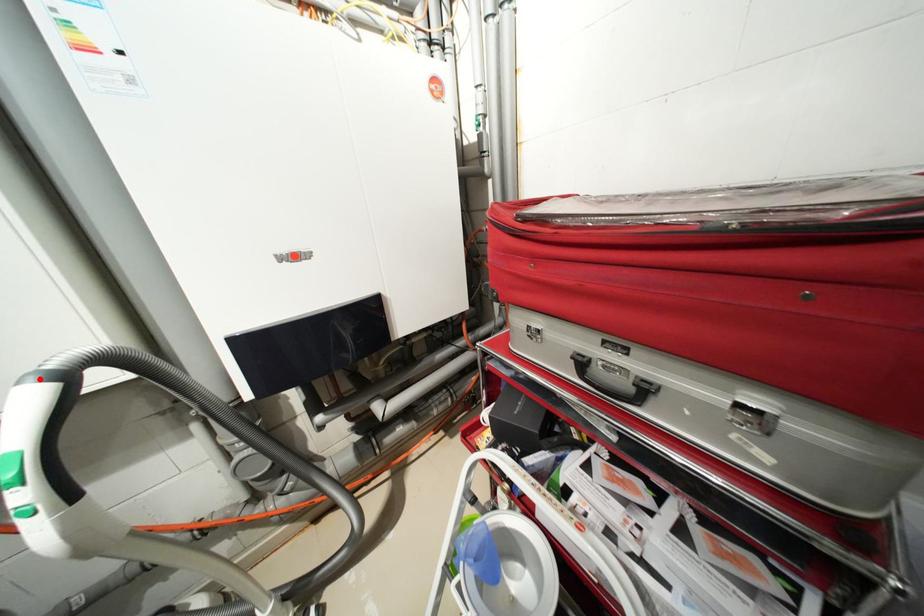
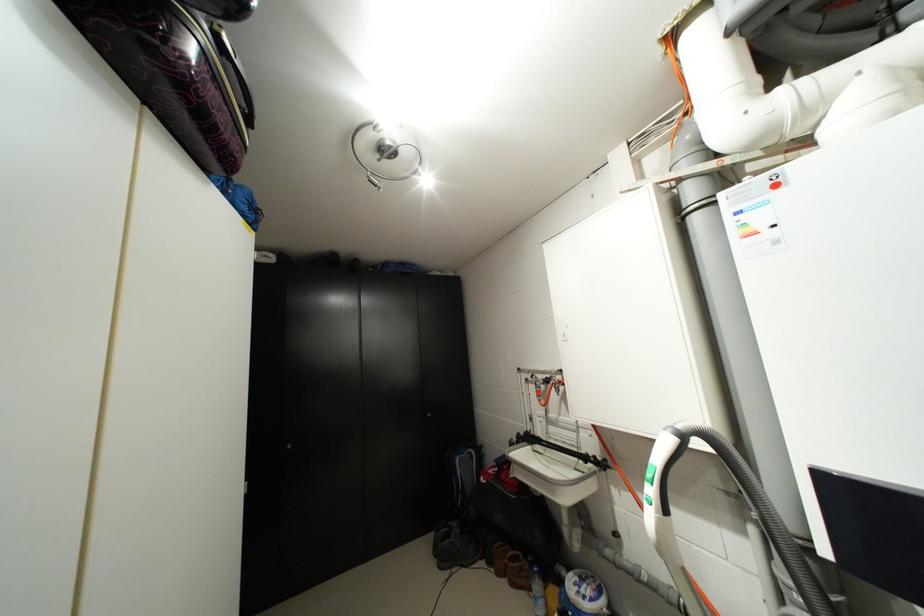
Locate, in the second image, the point that corresponds to the highlighted location in the first image.

(676, 431)